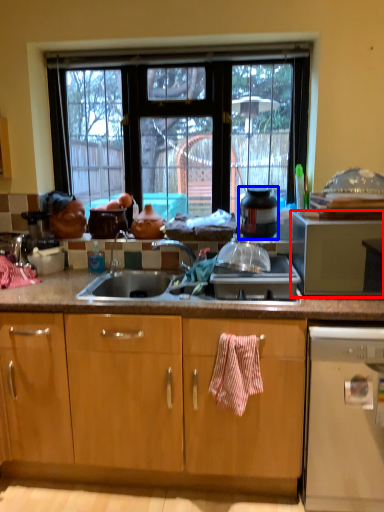
Question: Which object is further to the camera taking this photo, microwave oven (highlighted by a red box) or appliance (highlighted by a blue box)?

Choices:
 (A) microwave oven
 (B) appliance

Answer: (B)